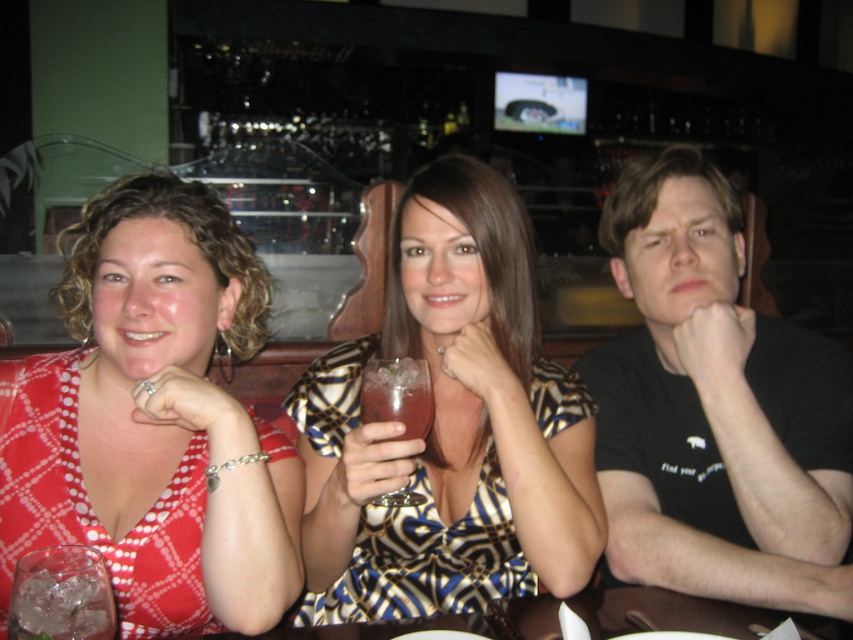
You are standing in front of the bar scene described. There are two points marked in the image. Which point, point (258, 436) or point (730, 333), is closer to you?

Point (258, 436) is closer to the viewer than point (730, 333).

In the scene shown: What is the 2D coordinate of the polka dot fabric dress at left in the image?

The polka dot fabric dress at left is located at the 2D coordinate point of (154, 420).